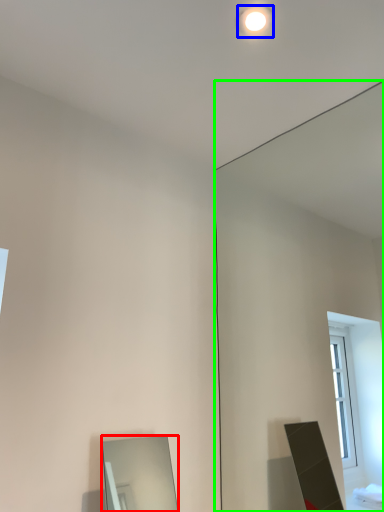
Question: Considering the real-world distances, which object is farthest from mirror (highlighted by a red box)? lighting (highlighted by a blue box) or mirror (highlighted by a green box)?

Choices:
 (A) lighting
 (B) mirror

Answer: (A)